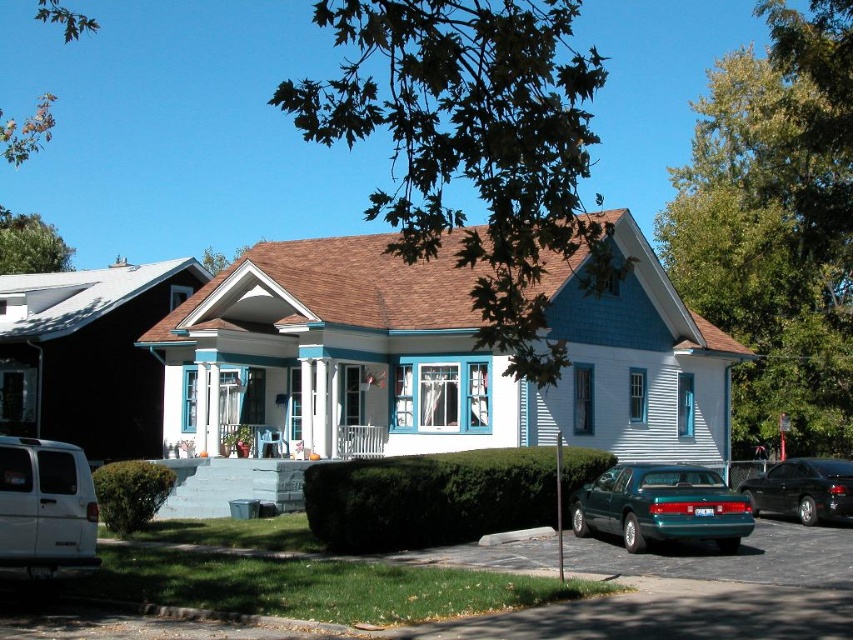
Question: Where is teal glossy sedan at lower right located in relation to white matte van at lower left in the image?

Choices:
 (A) above
 (B) below

Answer: (B)

Question: Which point is closer to the camera?

Choices:
 (A) (701, 476)
 (B) (83, 545)
 (C) (836, 476)

Answer: (B)

Question: Does white matte van at lower left have a greater width compared to shiny black sedan at lower right?

Choices:
 (A) yes
 (B) no

Answer: (B)

Question: Which of the following is the farthest from the observer?

Choices:
 (A) teal glossy sedan at lower right
 (B) shiny black sedan at lower right

Answer: (B)

Question: Which object is the closest to the teal glossy sedan at lower right?

Choices:
 (A) shiny black sedan at lower right
 (B) white matte van at lower left

Answer: (A)

Question: Can you confirm if teal glossy sedan at lower right is positioned to the left of shiny black sedan at lower right?

Choices:
 (A) no
 (B) yes

Answer: (B)